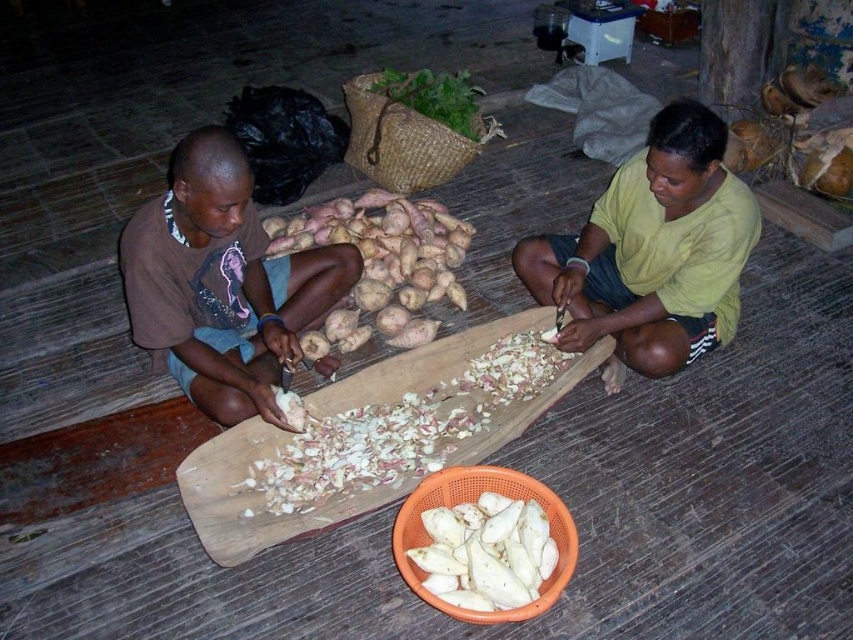
Question: Which object is closer to the camera taking this photo?

Choices:
 (A) brown matte potatoes at center
 (B) brown cotton shirt at left

Answer: (B)

Question: Can you confirm if yellow matte shirt at center is smaller than green leafy vegetable at upper center?

Choices:
 (A) yes
 (B) no

Answer: (B)

Question: Among these objects, which one is nearest to the camera?

Choices:
 (A) brown cotton shirt at left
 (B) white matte potato at center

Answer: (A)

Question: Can you confirm if yellow matte shirt at center is bigger than white matte tubers at center?

Choices:
 (A) no
 (B) yes

Answer: (B)

Question: Is yellow matte shirt at center behind white matte potato at center?

Choices:
 (A) yes
 (B) no

Answer: (B)

Question: Which point appears farthest from the camera in this image?

Choices:
 (A) (494, 566)
 (B) (560, 250)

Answer: (B)